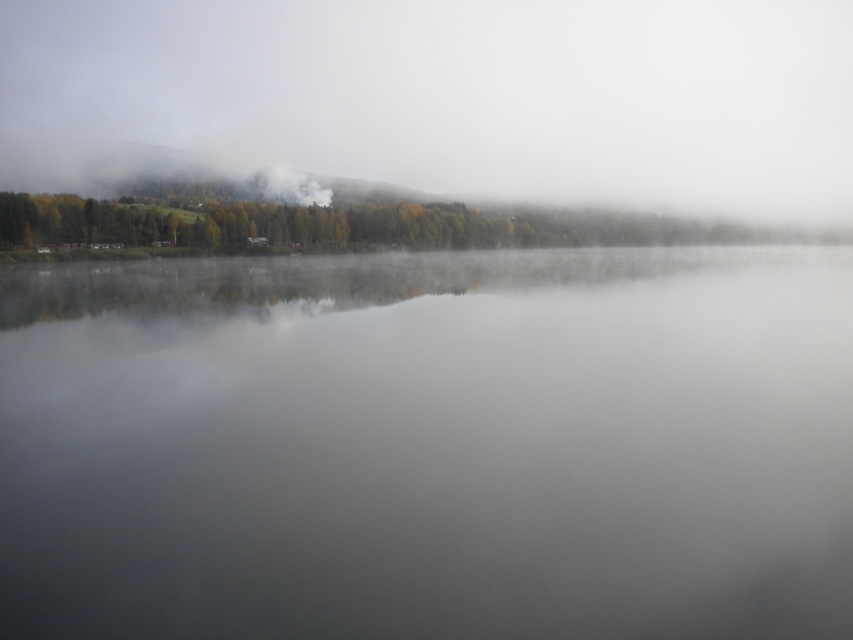
Measure the distance between transparent water at center and white misty fog at upper center.

transparent water at center is 163.94 meters away from white misty fog at upper center.

Measure the distance between transparent water at center and camera.

They are 7.23 meters apart.

This screenshot has width=853, height=640. Find the location of `transparent water at center`. transparent water at center is located at coordinates (428, 445).

Is white misty fog at upper center wider than green matte trees at upper center?

Indeed, white misty fog at upper center has a greater width compared to green matte trees at upper center.

Is point (274, 49) positioned before point (486, 227)?

No, (274, 49) is further to viewer.

Who is more forward, (329, 156) or (498, 227)?

Positioned in front is point (498, 227).

The width and height of the screenshot is (853, 640). I want to click on white misty fog at upper center, so click(450, 97).

Does point (94, 618) lie behind point (256, 209)?

No, it is not.

Where is `transparent water at center`? The height and width of the screenshot is (640, 853). transparent water at center is located at coordinates (428, 445).